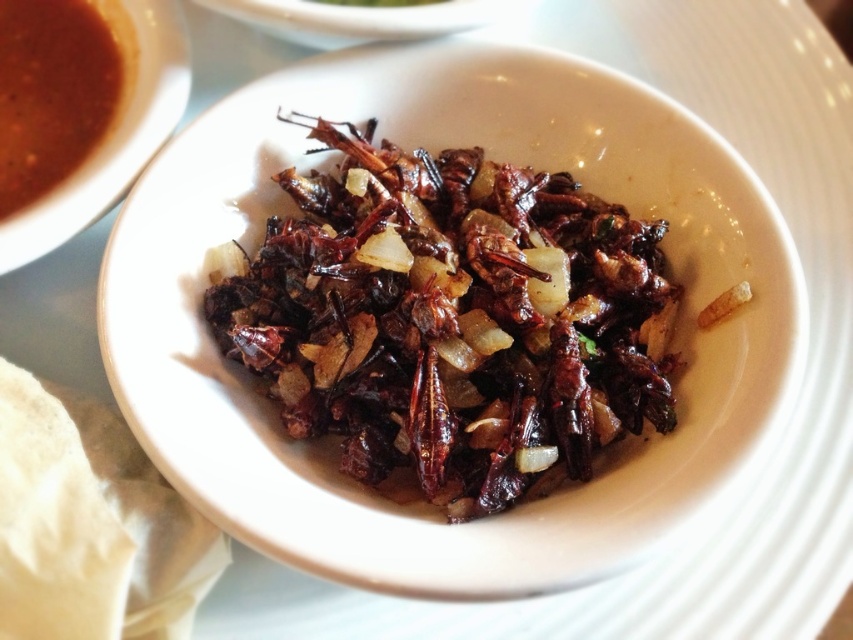
Is brown crispy insects at center below brown matte soup at upper left?

Correct, brown crispy insects at center is located below brown matte soup at upper left.

Does brown crispy insects at center have a lesser height compared to brown matte soup at upper left?

In fact, brown crispy insects at center may be taller than brown matte soup at upper left.

This screenshot has height=640, width=853. I want to click on brown crispy insects at center, so click(x=451, y=320).